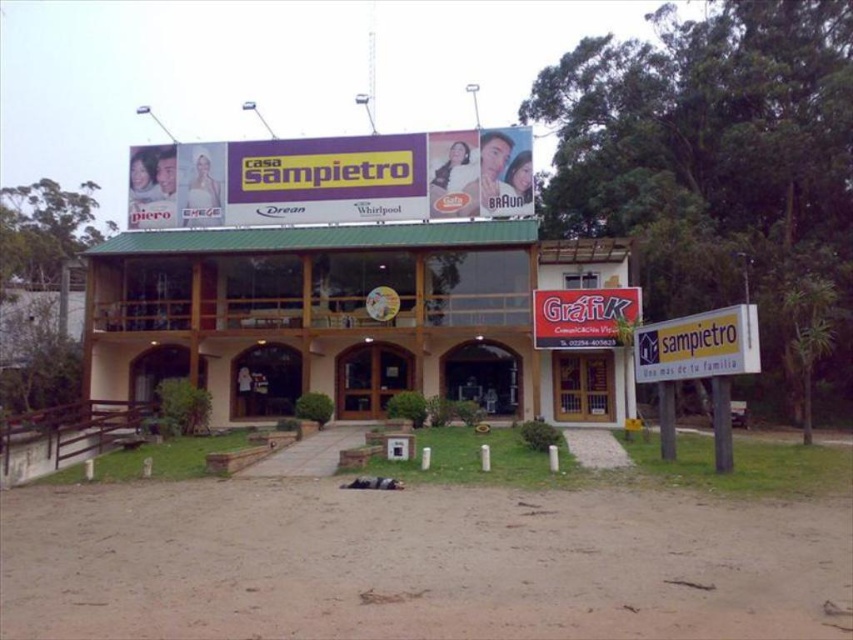
You are a customer entering the building and see the white plastic sign at lower right and the red plastic sign at center. Which sign is closer to the ground?

The white plastic sign at lower right is closer to the ground because it is positioned under the red plastic sign at center.

You are a delivery driver who needs to deliver a package to the brown wooden hotel at center. However, there is a red plastic sign at center blocking the path. Can you drive through the space between them?

The red plastic sign at center is behind the brown wooden hotel at center, so there is no space between them for the delivery driver to pass through.

You are standing in front of the two story building with the billboard. You notice two points marked on the image. The first point is at coordinates point (751, 365) and the second is at point (569, 339). Which point is closer to you?

Point (751, 365) is in front of point (569, 339), so the first point is closer to you.